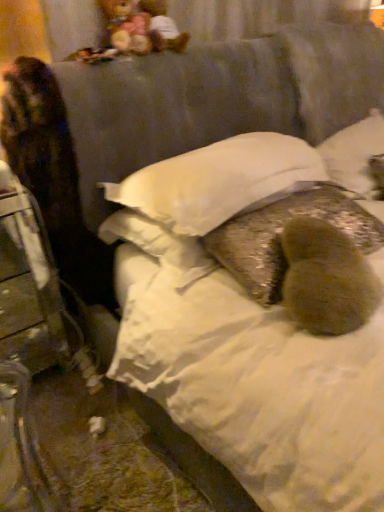
Question: From the image's perspective, would you say fuzzy brown pillow at center is shown under multicolored plush at upper left, the second figurine from the right?

Choices:
 (A) no
 (B) yes

Answer: (B)

Question: Does fuzzy brown pillow at center turn towards multicolored plush at upper left, the second figurine from the right?

Choices:
 (A) no
 (B) yes

Answer: (A)

Question: Is fuzzy brown pillow at center shorter than multicolored plush at upper left, placed as the 1th figurine when sorted from left to right?

Choices:
 (A) yes
 (B) no

Answer: (B)

Question: Does fuzzy brown pillow at center have a greater width compared to multicolored plush at upper left, the second figurine from the right?

Choices:
 (A) yes
 (B) no

Answer: (A)

Question: From a real-world perspective, is fuzzy brown pillow at center physically above multicolored plush at upper left, placed as the 1th figurine when sorted from left to right?

Choices:
 (A) no
 (B) yes

Answer: (A)

Question: Considering their positions, is white soft pillow at center, marked as the first pillow in a left-to-right arrangement, located in front of or behind silky white pillow at upper right, the third pillow positioned from the left?

Choices:
 (A) behind
 (B) front

Answer: (B)

Question: Looking at the image, does white soft pillow at center, which is the third pillow in right-to-left order, seem bigger or smaller compared to silky white pillow at upper right, the third pillow positioned from the left?

Choices:
 (A) big
 (B) small

Answer: (A)

Question: Is white soft pillow at center, marked as the first pillow in a left-to-right arrangement, situated inside silky white pillow at upper right, the first pillow positioned from the right, or outside?

Choices:
 (A) outside
 (B) inside

Answer: (A)

Question: From a real-world perspective, is white soft pillow at center, which is the third pillow in right-to-left order, above or below silky white pillow at upper right, the third pillow positioned from the left?

Choices:
 (A) above
 (B) below

Answer: (A)

Question: From a real-world perspective, is multicolored plush at upper left, placed as the 1th figurine when sorted from left to right, physically located above or below fuzzy brown pillow at center, marked as the 2th pillow in a right-to-left arrangement?

Choices:
 (A) above
 (B) below

Answer: (A)

Question: In terms of width, does multicolored plush at upper left, placed as the 1th figurine when sorted from left to right, look wider or thinner when compared to fuzzy brown pillow at center, which is the second pillow from left to right?

Choices:
 (A) thin
 (B) wide

Answer: (A)

Question: Is point (105, 16) closer or farther from the camera than point (292, 208)?

Choices:
 (A) farther
 (B) closer

Answer: (A)

Question: Considering the positions of multicolored plush at upper left, the second figurine from the right, and fuzzy brown pillow at center, which is the second pillow from left to right, in the image, is multicolored plush at upper left, the second figurine from the right, bigger or smaller than fuzzy brown pillow at center, which is the second pillow from left to right,?

Choices:
 (A) big
 (B) small

Answer: (B)

Question: Is multicolored plush at upper left, placed as the 1th figurine when sorted from left to right, spatially inside white soft pillow at center, which is the third pillow in right-to-left order, or outside of it?

Choices:
 (A) outside
 (B) inside

Answer: (A)

Question: Is point (147, 46) positioned closer to the camera than point (216, 224)?

Choices:
 (A) farther
 (B) closer

Answer: (A)